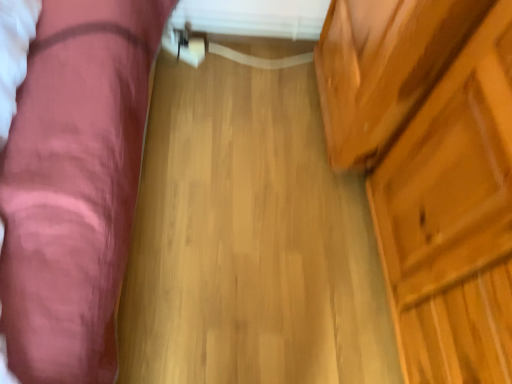
Question: Is velvet pink couch at left closer to camera compared to natural wood floor at center?

Choices:
 (A) yes
 (B) no

Answer: (A)

Question: Can you confirm if velvet pink couch at left is taller than natural wood floor at center?

Choices:
 (A) no
 (B) yes

Answer: (B)

Question: Is velvet pink couch at left at the right side of natural wood floor at center?

Choices:
 (A) no
 (B) yes

Answer: (A)

Question: Is velvet pink couch at left touching natural wood floor at center?

Choices:
 (A) no
 (B) yes

Answer: (A)

Question: Is there a large distance between velvet pink couch at left and natural wood floor at center?

Choices:
 (A) yes
 (B) no

Answer: (B)

Question: Considering the positions of point (146, 317) and point (60, 173), is point (146, 317) closer or farther from the camera than point (60, 173)?

Choices:
 (A) closer
 (B) farther

Answer: (B)

Question: Is natural wood floor at center inside or outside of velvet pink couch at left?

Choices:
 (A) inside
 (B) outside

Answer: (B)

Question: From the image's perspective, is natural wood floor at center positioned above or below velvet pink couch at left?

Choices:
 (A) above
 (B) below

Answer: (B)

Question: Looking at the image, does natural wood floor at center seem bigger or smaller compared to velvet pink couch at left?

Choices:
 (A) small
 (B) big

Answer: (A)

Question: From their relative heights in the image, would you say velvet pink couch at left is taller or shorter than natural wood floor at center?

Choices:
 (A) tall
 (B) short

Answer: (A)

Question: Relative to natural wood floor at center, is velvet pink couch at left in front or behind?

Choices:
 (A) behind
 (B) front

Answer: (B)

Question: Looking at their shapes, would you say velvet pink couch at left is wider or thinner than natural wood floor at center?

Choices:
 (A) thin
 (B) wide

Answer: (A)

Question: Considering the positions of point (41, 11) and point (351, 273), is point (41, 11) closer or farther from the camera than point (351, 273)?

Choices:
 (A) closer
 (B) farther

Answer: (A)

Question: Based on their positions, is natural wood floor at center located to the left or right of wooden dresser at right?

Choices:
 (A) left
 (B) right

Answer: (A)

Question: Is natural wood floor at center taller or shorter than wooden dresser at right?

Choices:
 (A) short
 (B) tall

Answer: (A)